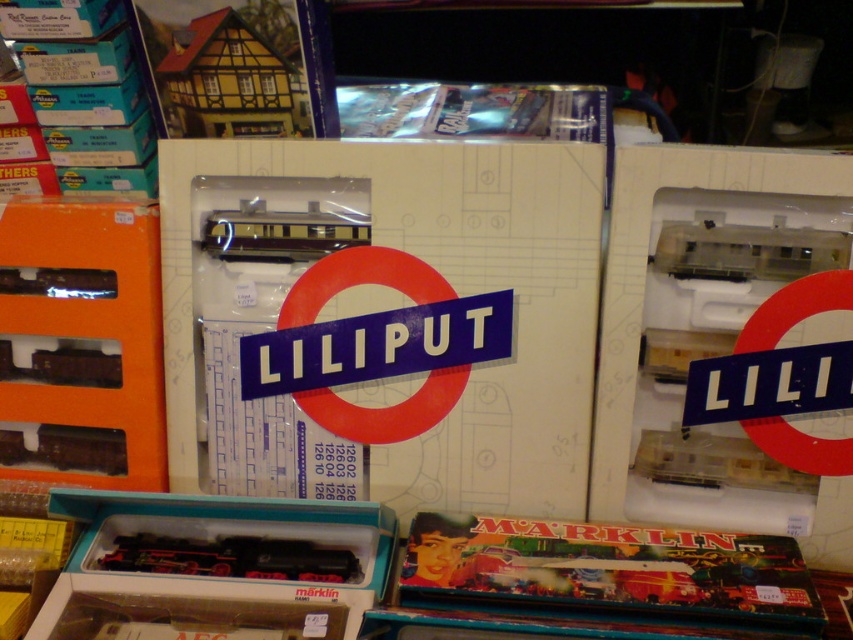
Question: Which point is closer to the camera?

Choices:
 (A) white cardboard box at center
 (B) yellow wood house at upper left

Answer: (A)

Question: Does white cardboard box at center appear over transparent plastic train at center?

Choices:
 (A) yes
 (B) no

Answer: (A)

Question: Considering the relative positions of orange matte train set at left and yellow wood house at upper left in the image provided, where is orange matte train set at left located with respect to yellow wood house at upper left?

Choices:
 (A) right
 (B) left

Answer: (B)

Question: Which of these objects is positioned closest to the matte black train at lower left?

Choices:
 (A) yellow wood house at upper left
 (B) transparent plastic train at center
 (C) orange matte train set at left

Answer: (C)

Question: Can you confirm if orange matte train set at left is positioned above shiny black locomotive at lower left?

Choices:
 (A) yes
 (B) no

Answer: (A)

Question: Which of the following is the closest to the observer?

Choices:
 (A) shiny black locomotive at lower left
 (B) matte black train at lower left

Answer: (B)